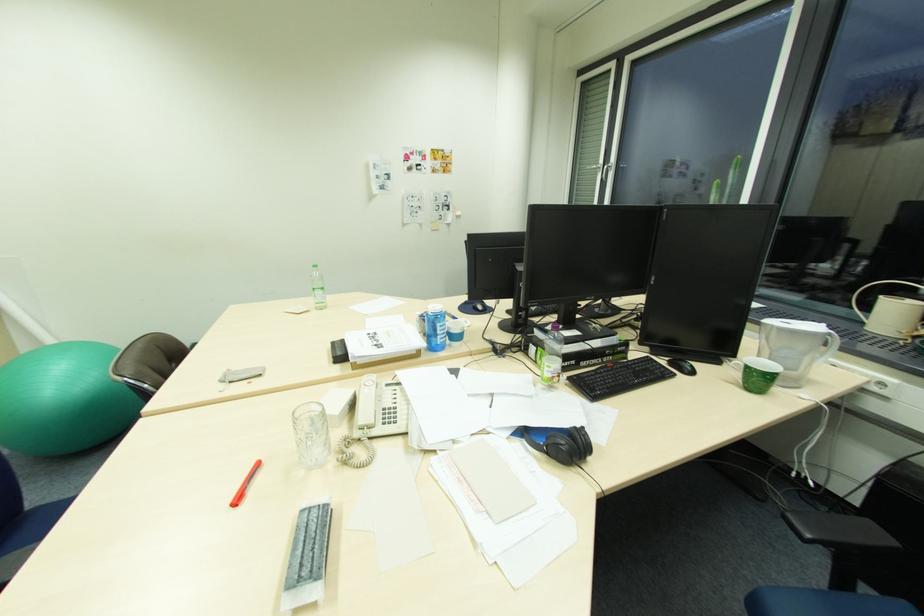
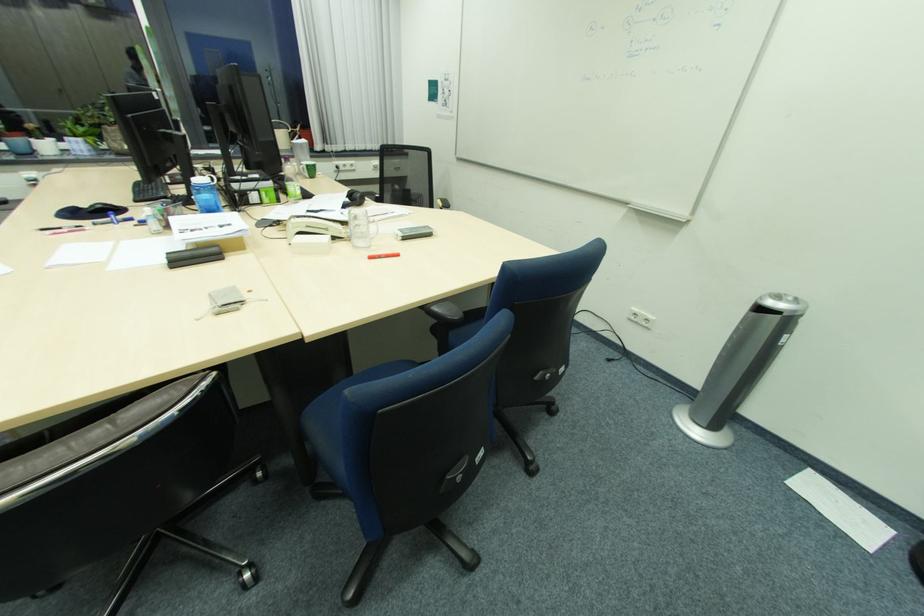
Locate, in the second image, the point that corresponds to pixel 348 341 in the first image.

(175, 254)